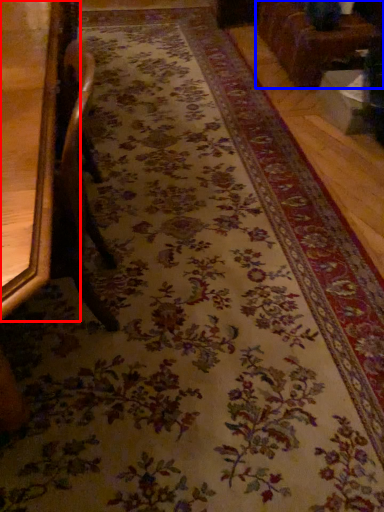
Question: Which object appears closest to the camera in this image, furniture (highlighted by a red box) or furniture (highlighted by a blue box)?

Choices:
 (A) furniture
 (B) furniture

Answer: (A)